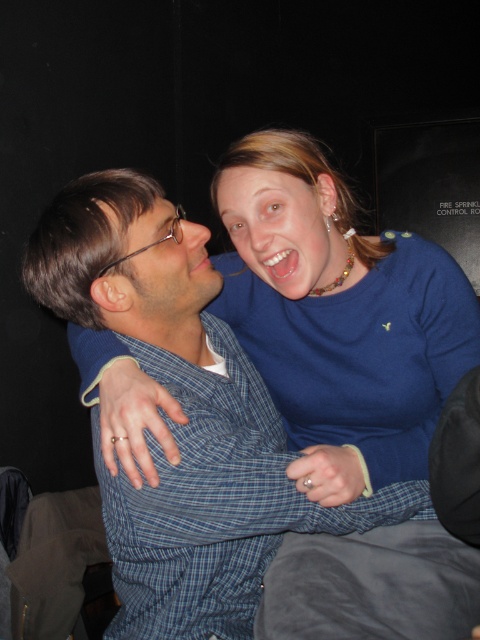
Looking at this image, you are standing in a dark room and see two glowing points of light. One is labeled as point (250, 308) and the other as point (312, 259). According to the image, which point is closer to you?

Point (312, 259) is closer to you because it is in front of point (250, 308).

You are sitting in the front row of a theater and see the blue fabric shirt at upper center and the matte blue shirt at center. Which one is nearer to you?

The blue fabric shirt at upper center is closer to the viewer than the matte blue shirt at center, so the blue fabric shirt at upper center is nearer to you.

You are designing a poster for a play and need to ensure the blue fabric shirt at upper center and the blue fabric face at upper right are both visible. Based on their sizes, which one should you prioritize placing first to fit both elements?

The blue fabric shirt at upper center is wider than the blue fabric face at upper right, so you should prioritize placing the blue fabric shirt at upper center first to ensure both elements fit on the poster.